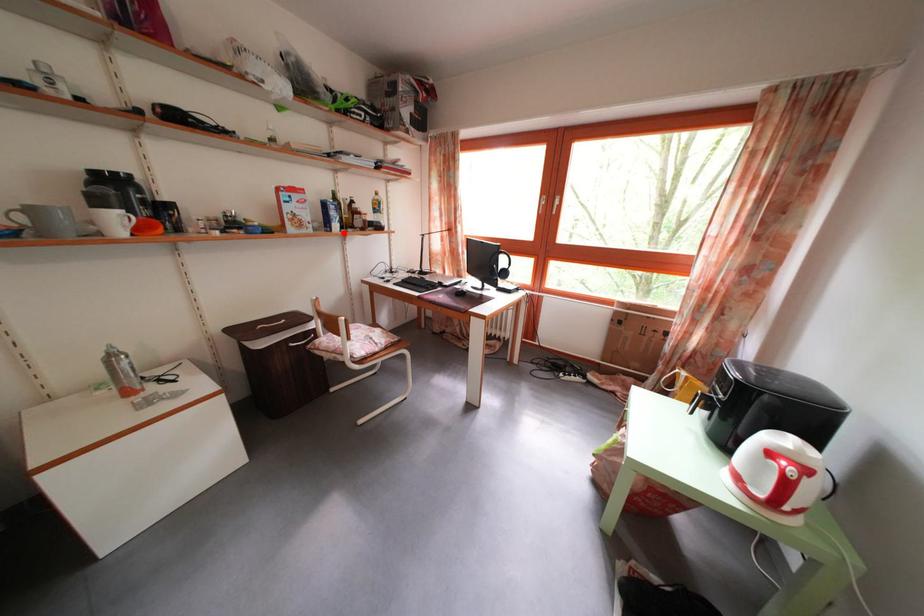
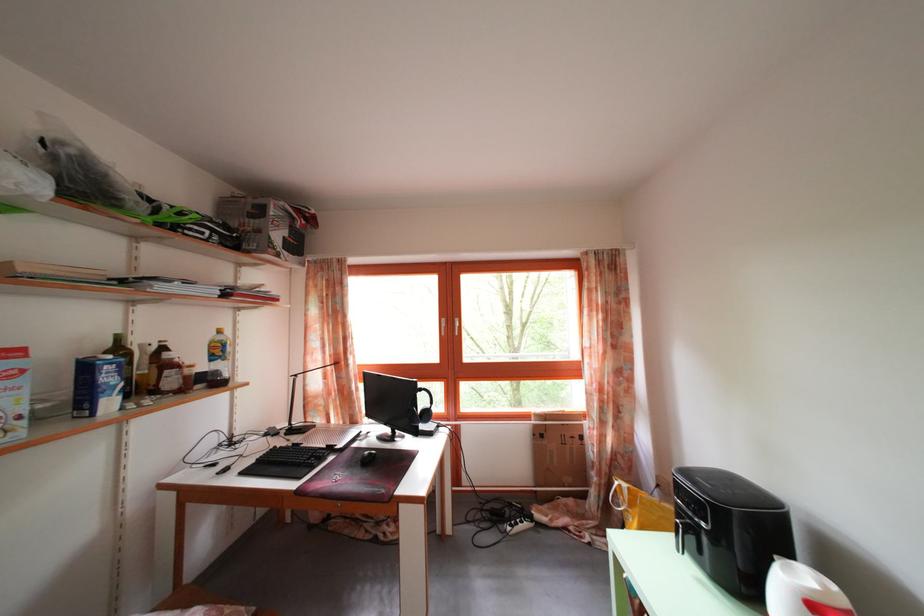
In the second image, find the point that corresponds to the highlighted location in the first image.

(117, 410)